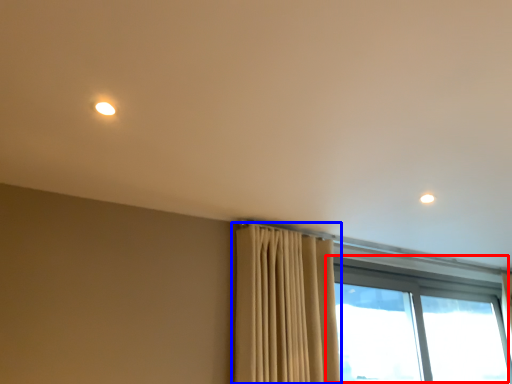
Question: Which object is further to the camera taking this photo, window (highlighted by a red box) or curtain (highlighted by a blue box)?

Choices:
 (A) window
 (B) curtain

Answer: (A)